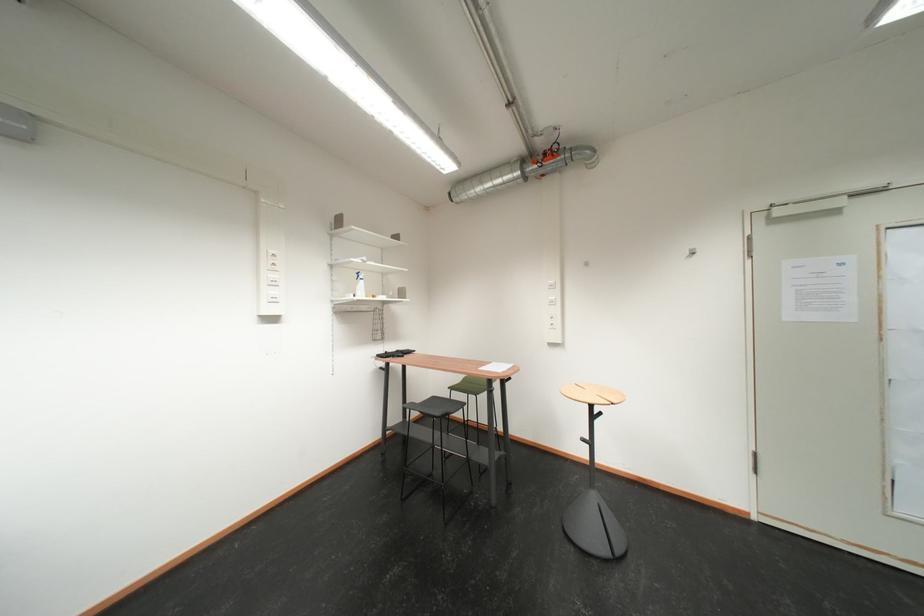
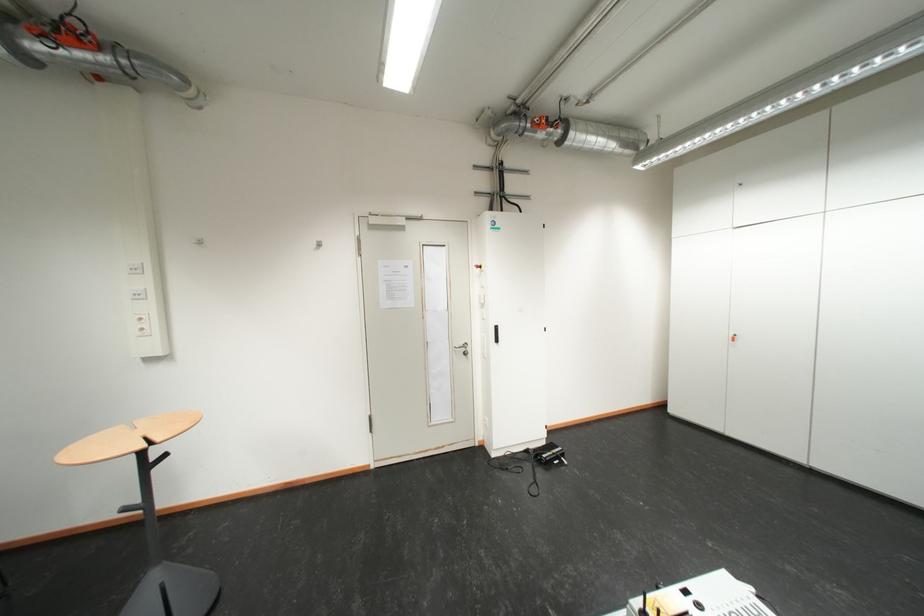
Find the pixel in the second image that matches (x=536, y=180) in the first image.

(35, 60)